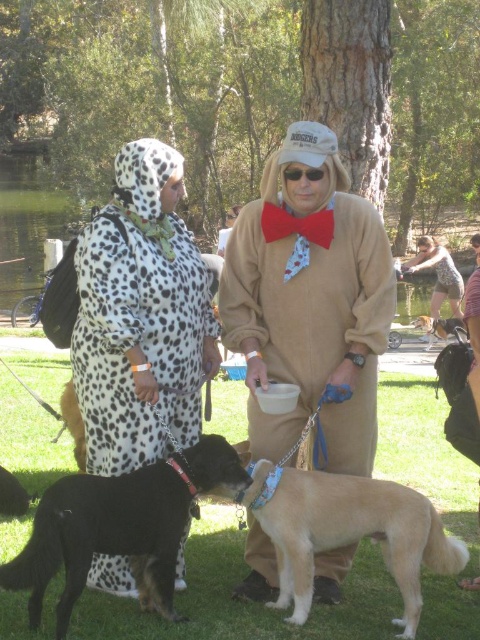
Which is below, black fur dog at center or soft brown fur at center?

Positioned lower is black fur dog at center.

Image resolution: width=480 pixels, height=640 pixels. What do you see at coordinates (73, 422) in the screenshot?
I see `black fur dog at center` at bounding box center [73, 422].

You are a GUI agent. You are given a task and a screenshot of the screen. Output one action in this format:
    pyautogui.click(x=<x>, y=<y>)
    Task: Click on the black fur dog at center
    
    Given the screenshot: What is the action you would take?
    pyautogui.click(x=73, y=422)

Measure the distance between beige plush onesie at center and black fur dog at center.

6.93 feet

Is beige plush onesie at center wider than black fur dog at center?

Correct, the width of beige plush onesie at center exceeds that of black fur dog at center.

Which is behind, point (344, 410) or point (60, 397)?

The point (60, 397) is more distant.

Find the location of `beige plush onesie at center`. beige plush onesie at center is located at coordinates (310, 300).

Which is more to the right, beige plush onesie at center or light brown fur at center?

light brown fur at center

Who is positioned more to the left, beige plush onesie at center or light brown fur at center?

beige plush onesie at center

Which is in front, point (300, 384) or point (360, 518)?

Point (360, 518)

The width and height of the screenshot is (480, 640). I want to click on beige plush onesie at center, so click(310, 300).